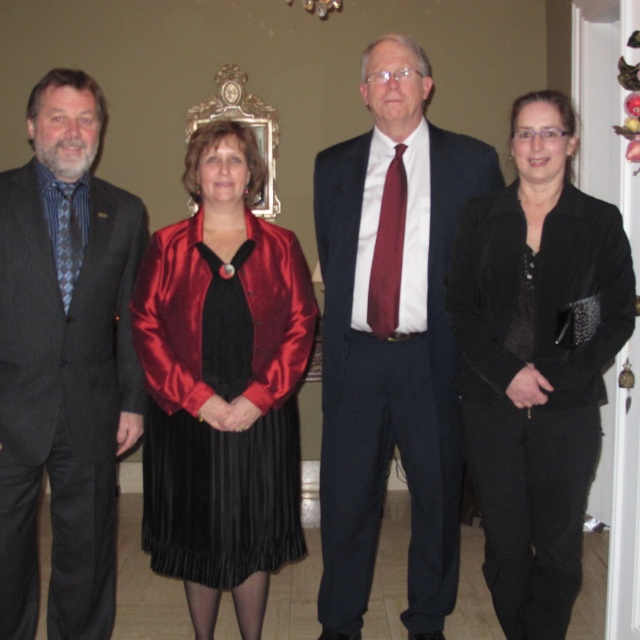
What do you see at coordinates (65, 371) in the screenshot? I see `matte black suit at left` at bounding box center [65, 371].

Is point (33, 188) closer to camera compared to point (214, 324)?

That is True.

Which is behind, point (22, 349) or point (250, 232)?

The point (250, 232) is behind.

I want to click on matte black suit at left, so click(x=65, y=371).

Between matte black suit at center and velvet black jacket at center, which one appears on the left side from the viewer's perspective?

matte black suit at center

Does matte black suit at center lie behind velvet black jacket at center?

Yes, it is.

Describe the element at coordinates (390, 340) in the screenshot. This screenshot has width=640, height=640. I see `matte black suit at center` at that location.

I want to click on matte black suit at center, so click(390, 340).

Describe the element at coordinates (387, 250) in the screenshot. I see `burgundy silk tie at center` at that location.

Between point (381, 214) and point (54, 220), which one is positioned in front?

Point (54, 220) is in front.

Find the location of `burgundy silk tie at center`. burgundy silk tie at center is located at coordinates (387, 250).

Where is `burgundy silk tie at center`? The width and height of the screenshot is (640, 640). burgundy silk tie at center is located at coordinates (387, 250).